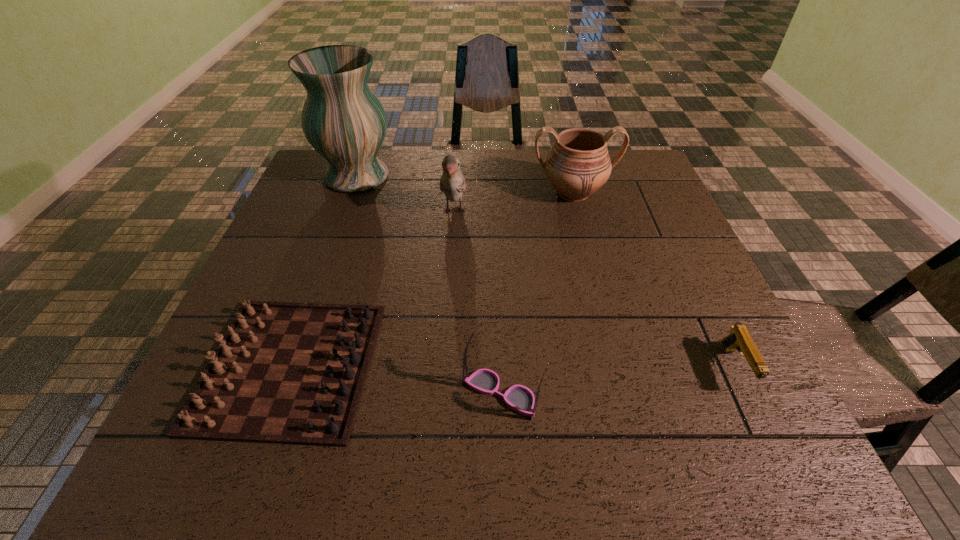
Where is `free location located 0.070m on the front of the fourth tallest object`? free location located 0.070m on the front of the fourth tallest object is located at coordinates (504, 461).

What are the coordinates of `blank area located at the barrel of the pistol` in the screenshot? It's located at (782, 467).

Find the location of a particular element. The width and height of the screenshot is (960, 540). vacant space situated on the back of the chessboard is located at coordinates (346, 211).

In order to click on vase that is at the far edge in this screenshot , I will do `click(343, 120)`.

At what (x,y) coordinates should I click in order to perform the action: click on urn that is at the far edge. Please return your answer as a coordinate pair (x, y). Looking at the image, I should click on (578, 164).

The height and width of the screenshot is (540, 960). What are the coordinates of `object present at the near edge` in the screenshot? It's located at (292, 373).

What are the coordinates of `vase that is at the left edge` in the screenshot? It's located at (343, 120).

I want to click on chessboard at the left edge, so click(x=292, y=373).

This screenshot has width=960, height=540. I want to click on urn located in the right edge section of the desktop, so click(578, 164).

Where is `pistol at the right edge`? Image resolution: width=960 pixels, height=540 pixels. pistol at the right edge is located at coordinates (739, 339).